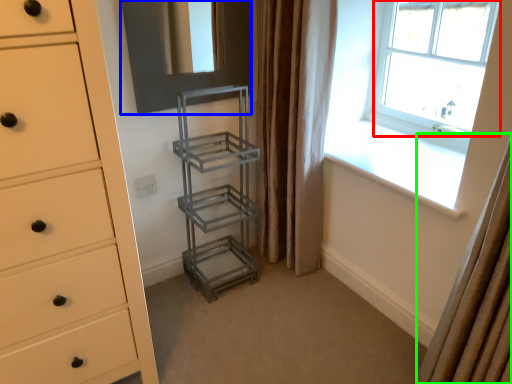
Question: Considering the real-world distances, which object is closest to window (highlighted by a red box)? screen door (highlighted by a blue box) or curtain (highlighted by a green box).

Choices:
 (A) screen door
 (B) curtain

Answer: (A)